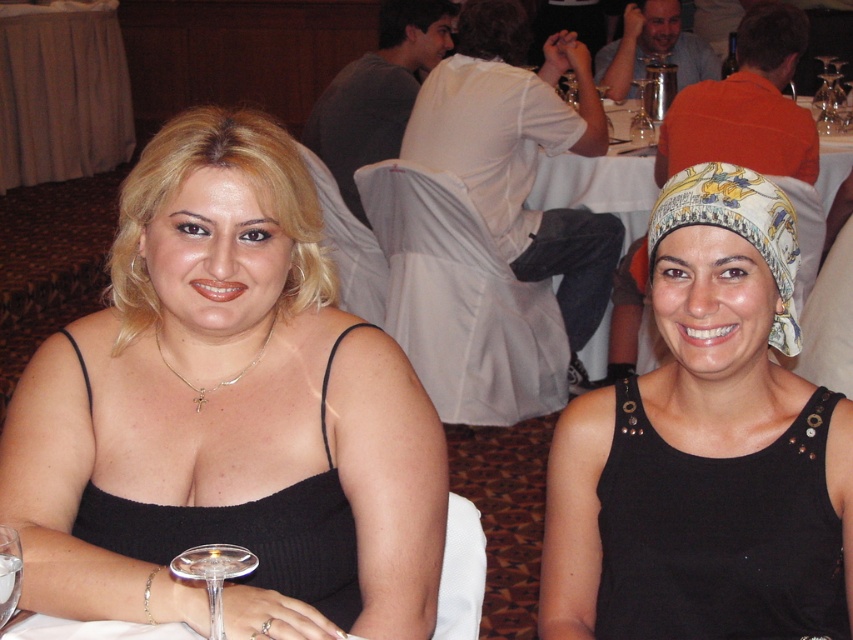
You are a photographer at the event and need to capture a photo that includes both the transparent glass at lower left and the transparent glass at upper center. The camera has a maximum focus range of 3 meters. Will you be able to capture both glasses in focus without moving the camera?

The transparent glass at lower left is 3.13 meters from the transparent glass at upper center. Since the distance between them exceeds the camera maximum focus range of 3 meters, you won be able to capture both glasses in focus without moving the camera.